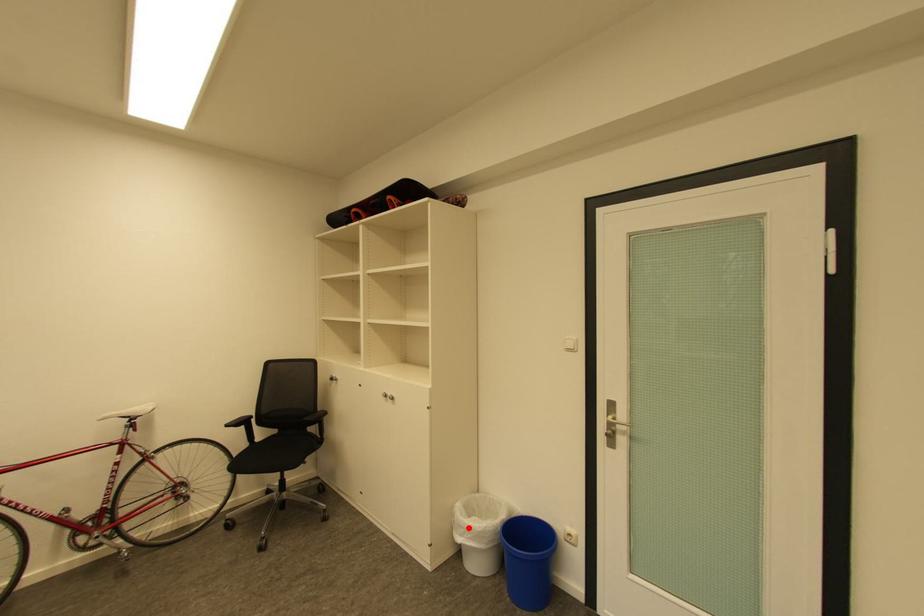
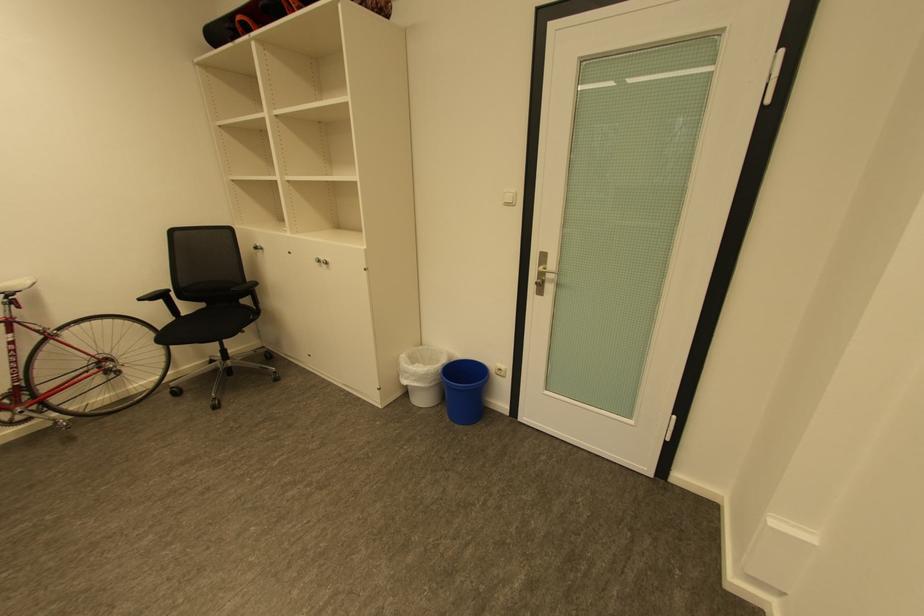
The point at the highlighted location is marked in the first image. Where is the corresponding point in the second image?

(414, 373)